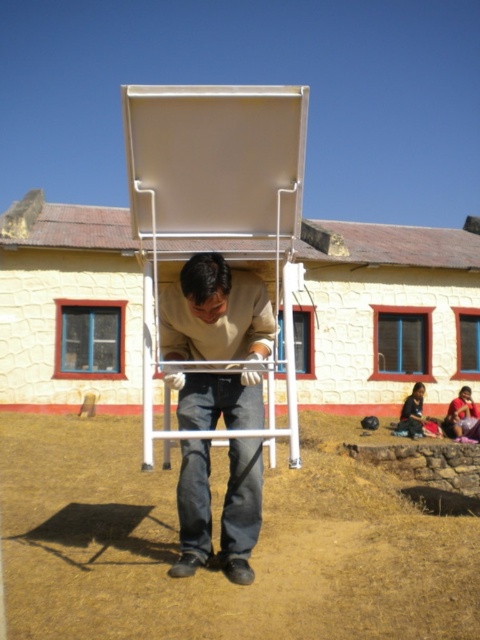
You are an artist setting up your equipment in the described outdoor scene. You have a white matte easel at center and a matte beige shirt at center. Which object is shorter?

The white matte easel at center is shorter than the matte beige shirt at center.